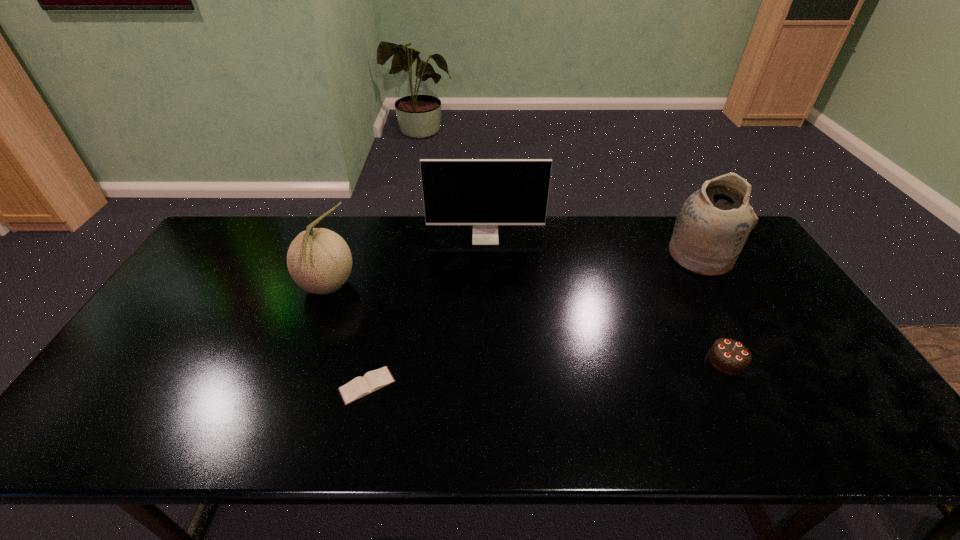
Locate an element on the screen. The height and width of the screenshot is (540, 960). object that stands as the fourth closest to the third object from left to right is located at coordinates (730, 356).

I want to click on blank area in the image that satisfies the following two spatial constraints: 1. on the front-facing side of the fourth tallest object; 2. on the right side of the third object from left to right, so click(x=487, y=361).

Where is `free location that satisfies the following two spatial constraints: 1. on the front side of the cantaloup; 2. on the left side of the chocolate cake`? free location that satisfies the following two spatial constraints: 1. on the front side of the cantaloup; 2. on the left side of the chocolate cake is located at coordinates (300, 361).

This screenshot has height=540, width=960. In order to click on free space that satisfies the following two spatial constraints: 1. on the front-facing side of the pottery; 2. on the left side of the third object from right to left in this screenshot , I will do `click(486, 256)`.

You are a GUI agent. You are given a task and a screenshot of the screen. Output one action in this format:
    pyautogui.click(x=<x>, y=<y>)
    Task: Click on the vacant area that satisfies the following two spatial constraints: 1. on the front-facing side of the pottery; 2. on the left side of the third object from left to right
    Image resolution: width=960 pixels, height=540 pixels.
    Given the screenshot: What is the action you would take?
    pyautogui.click(x=486, y=256)